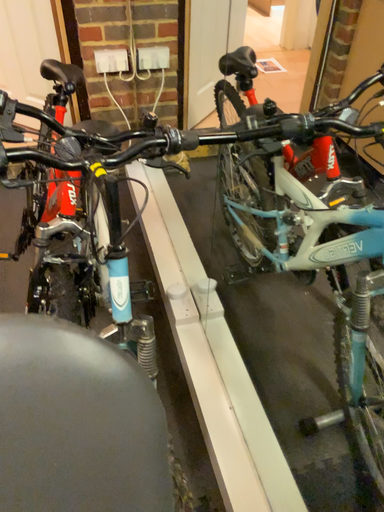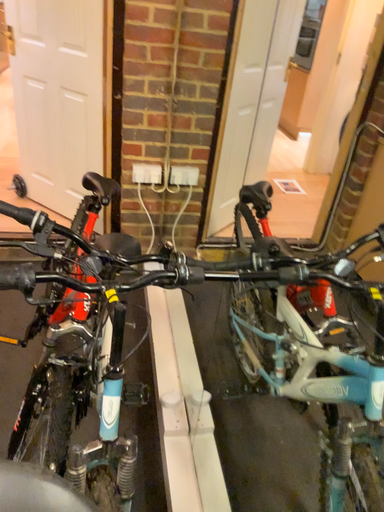
Question: Which way did the camera rotate in the video?

Choices:
 (A) rotated downward
 (B) rotated upward

Answer: (B)